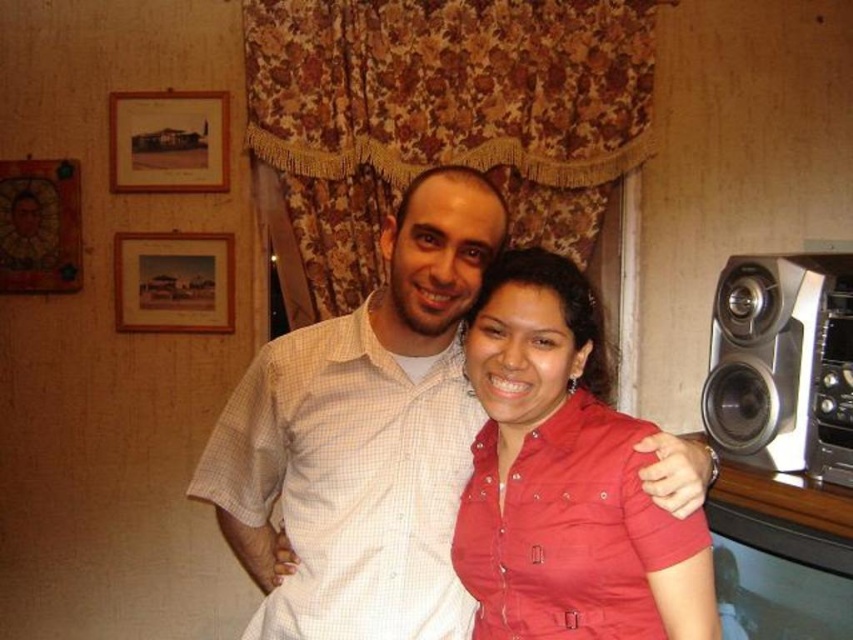
You are a photographer setting up for a group photo. You notice the white checkered shirt at center and the matte red shirt at center. Which shirt should you adjust to ensure both shirts are of equal width in the photo?

The white checkered shirt at center is wider than the matte red shirt at center. To make them equal, adjust the white checkered shirt at center to be narrower or the matte red shirt at center to be wider.

You are a photographer setting up for a portrait. You need to ensure that the matte red shirt at center and the silver metallic speaker at right are both visible in the frame. Based on their positions, which object is closer to the camera?

The matte red shirt at center is closer to the camera because it is in front of the silver metallic speaker at right.